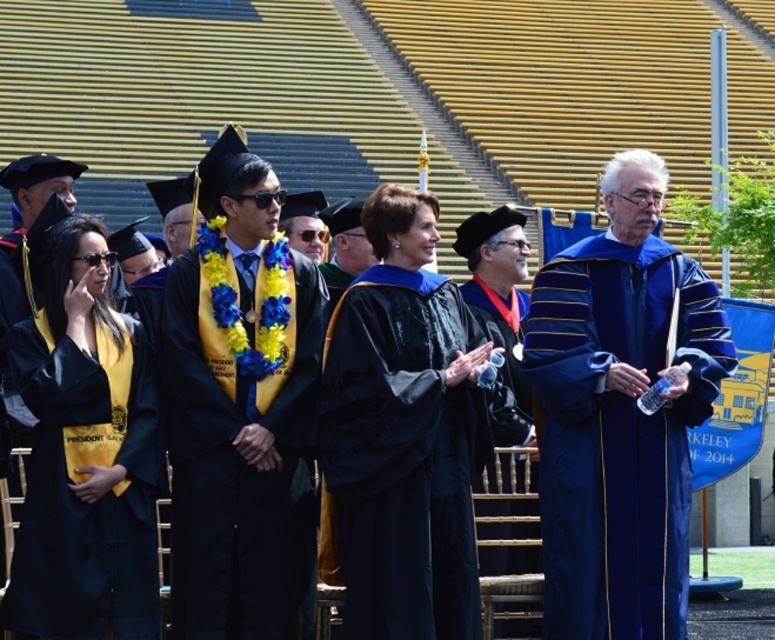
Is point (264, 522) more distant than point (147, 600)?

Yes, point (264, 522) is farther from viewer.

Is point (243, 404) less distant than point (138, 428)?

No, it is not.

Locate an element on the screen. The image size is (775, 640). matte black graduation gown at center is located at coordinates (239, 465).

Does matte black robe at center have a lesser width compared to matte black gown at left?

Indeed, matte black robe at center has a lesser width compared to matte black gown at left.

Does point (465, 429) come closer to viewer compared to point (50, 564)?

No, (465, 429) is behind (50, 564).

Find the location of a particular element. matte black robe at center is located at coordinates (400, 458).

Does blue velvet gown at center lie in front of matte black robe at center?

No.

Consider the image. Can you confirm if blue velvet gown at center is smaller than matte black robe at center?

Incorrect, blue velvet gown at center is not smaller in size than matte black robe at center.

Who is more distant from viewer, (608, 508) or (443, 540)?

The point (608, 508) is behind.

I want to click on blue velvet gown at center, so coord(620,413).